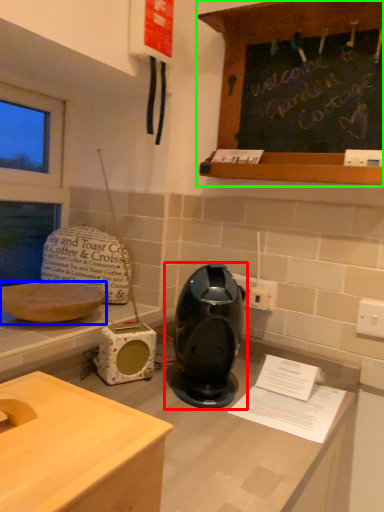
Question: Which object is positioned closest to home appliance (highlighted by a red box)? Select from kitchen appliance (highlighted by a blue box) and cabinetry (highlighted by a green box).

Choices:
 (A) kitchen appliance
 (B) cabinetry

Answer: (A)